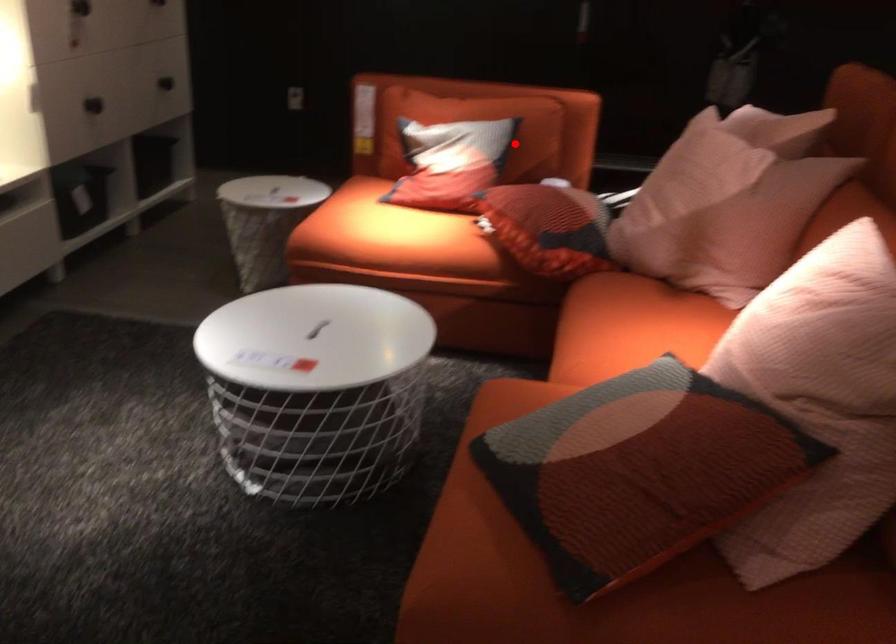
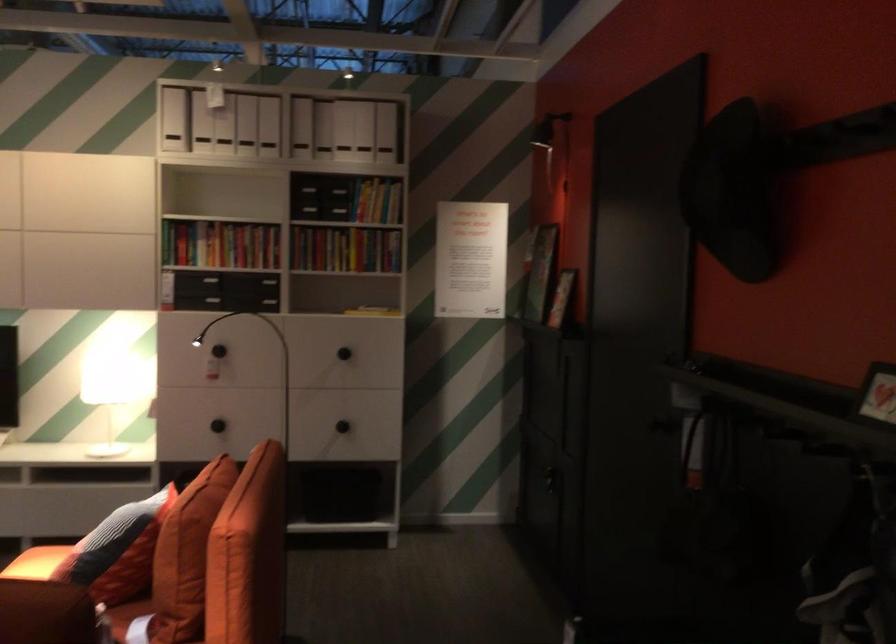
Question: I am providing you with two images of the same scene from different viewpoints. Given a red point in image1, look at the same physical point in image2. Is it:

Choices:
 (A) Closer to the viewpoint
 (B) Farther from the viewpoint

Answer: (A)